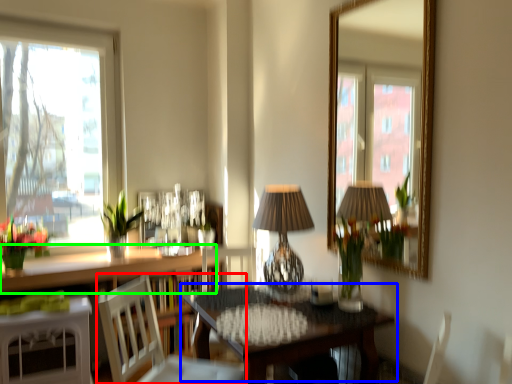
Question: Considering the real-world distances, which object is closest to chair (highlighted by a red box)? table (highlighted by a blue box) or counter top (highlighted by a green box).

Choices:
 (A) table
 (B) counter top

Answer: (A)